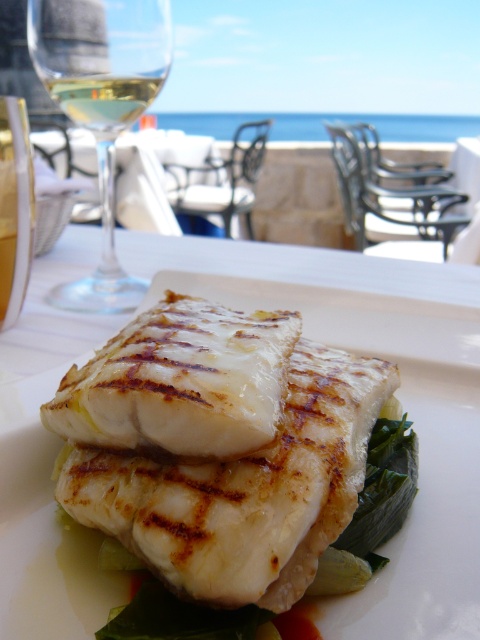
Does white glossy plate at center appear on the right side of clear glass wine at upper left?

Yes, white glossy plate at center is to the right of clear glass wine at upper left.

Is white glossy plate at center taller than clear glass wine at upper left?

Correct, white glossy plate at center is much taller as clear glass wine at upper left.

What do you see at coordinates (396, 394) in the screenshot? The width and height of the screenshot is (480, 640). I see `white glossy plate at center` at bounding box center [396, 394].

In order to click on white glossy plate at center in this screenshot , I will do `click(396, 394)`.

Which is below, clear glass wine glass at upper left or clear glass wine at upper left?

clear glass wine glass at upper left is below.

Is point (90, 19) closer to viewer compared to point (82, 97)?

That is True.

Between point (64, 100) and point (95, 125), which one is positioned behind?

The point (95, 125) is more distant.

Find the location of a particular element. This screenshot has height=640, width=480. clear glass wine glass at upper left is located at coordinates (100, 106).

Which of these two, clear glass wine glass at upper left or gold metallic wine glass at left, stands shorter?

With less height is gold metallic wine glass at left.

Does clear glass wine glass at upper left have a lesser height compared to gold metallic wine glass at left?

No, clear glass wine glass at upper left is not shorter than gold metallic wine glass at left.

Which is in front, point (44, 6) or point (12, 317)?

Point (12, 317) is more forward.

Identify the location of clear glass wine glass at upper left. This screenshot has height=640, width=480. (100, 106).